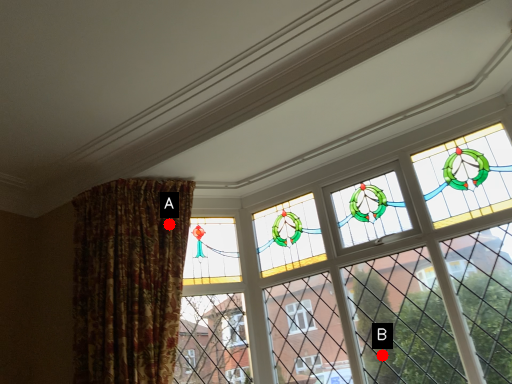
Question: Two points are circled on the image, labeled by A and B beside each circle. Which point is closer to the camera?

Choices:
 (A) A is closer
 (B) B is closer

Answer: (B)